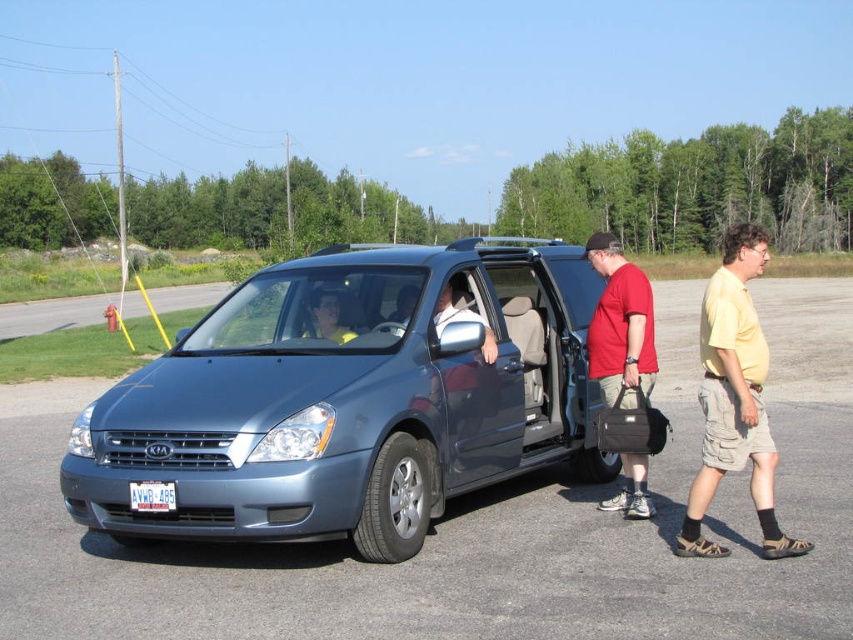
Question: Does yellow cotton shirt at center lie in front of matte red shirt at center?

Choices:
 (A) yes
 (B) no

Answer: (A)

Question: Which object is closer to the camera taking this photo?

Choices:
 (A) satin metallic minivan at center
 (B) white plastic license plate at center

Answer: (A)

Question: Can you confirm if yellow cotton shirt at center is bigger than white plastic license plate at center?

Choices:
 (A) no
 (B) yes

Answer: (B)

Question: Which point is farther from the camera taking this photo?

Choices:
 (A) [761, 461]
 (B) [653, 356]
 (C) [167, 508]

Answer: (B)

Question: Can you confirm if matte red shirt at center is positioned to the right of white plastic license plate at center?

Choices:
 (A) no
 (B) yes

Answer: (B)

Question: Which point appears farthest from the camera in this image?

Choices:
 (A) (637, 474)
 (B) (747, 236)
 (C) (135, 499)
 (D) (178, 524)

Answer: (A)